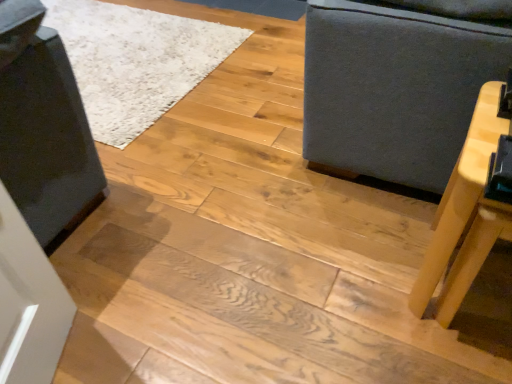
Question: From a real-world perspective, is light wood table at right physically located above or below gray fabric sofa at right?

Choices:
 (A) below
 (B) above

Answer: (A)

Question: Is point (463, 288) closer or farther from the camera than point (404, 66)?

Choices:
 (A) closer
 (B) farther

Answer: (A)

Question: From the image's perspective, relative to gray fabric sofa at right, is light wood table at right above or below?

Choices:
 (A) above
 (B) below

Answer: (B)

Question: Is gray fabric sofa at right spatially inside light wood table at right, or outside of it?

Choices:
 (A) inside
 (B) outside

Answer: (B)

Question: In terms of size, does gray fabric sofa at right appear bigger or smaller than light wood table at right?

Choices:
 (A) big
 (B) small

Answer: (A)

Question: Considering the positions of point (451, 160) and point (443, 238), is point (451, 160) closer or farther from the camera than point (443, 238)?

Choices:
 (A) closer
 (B) farther

Answer: (B)

Question: In the image, is gray fabric sofa at right on the left side or the right side of light wood table at right?

Choices:
 (A) left
 (B) right

Answer: (B)